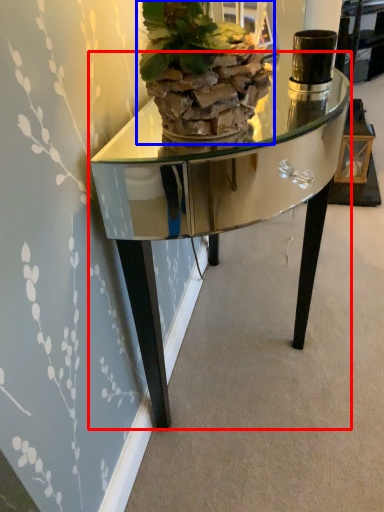
Question: Which object is closer to the camera taking this photo, table (highlighted by a red box) or houseplant (highlighted by a blue box)?

Choices:
 (A) table
 (B) houseplant

Answer: (B)